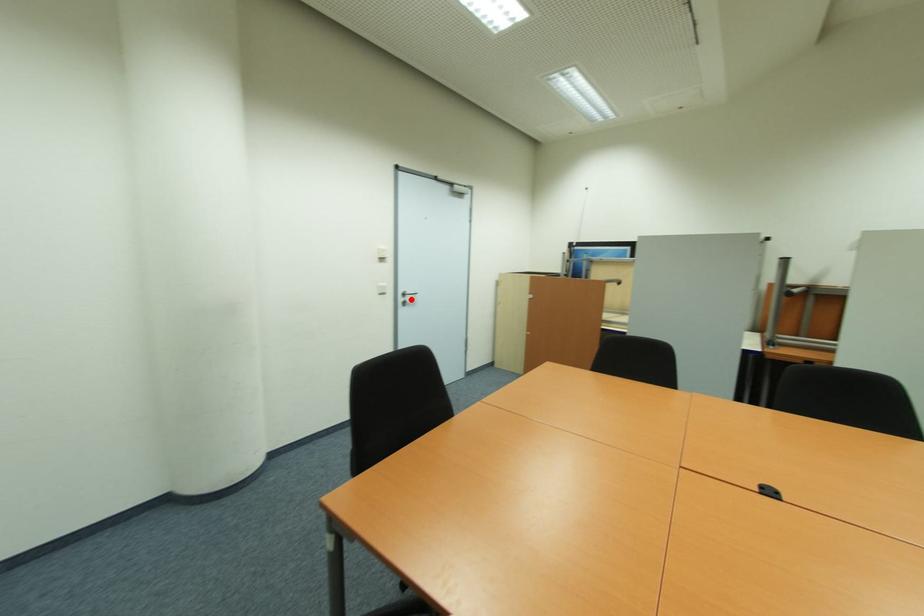
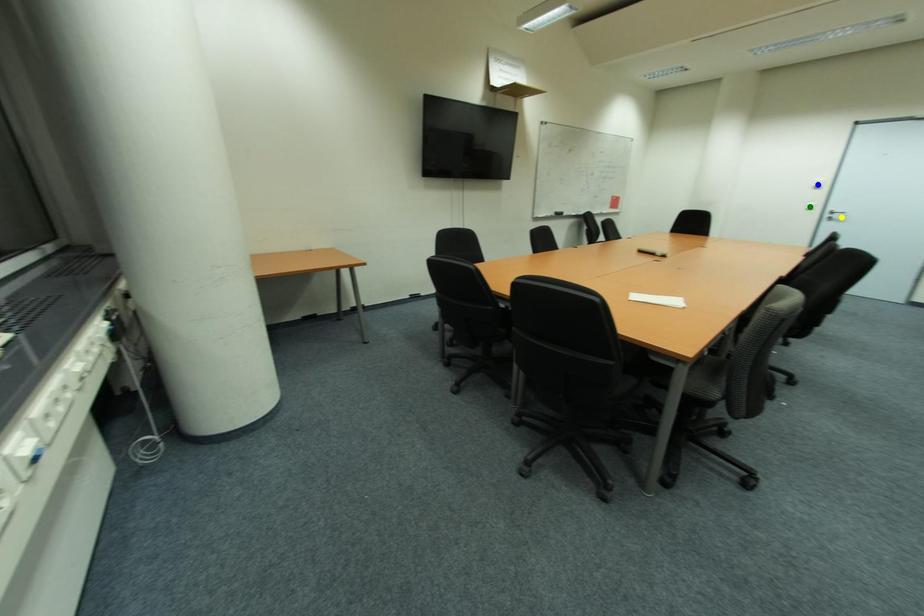
Question: I am providing you with two images of the same scene from different viewpoints. A red point is marked on the first image. You are given multiple points on the second image. Which point in image 2 is actually the same real-world point as the red point in image 1?

Choices:
 (A) blue point
 (B) yellow point
 (C) green point

Answer: (B)